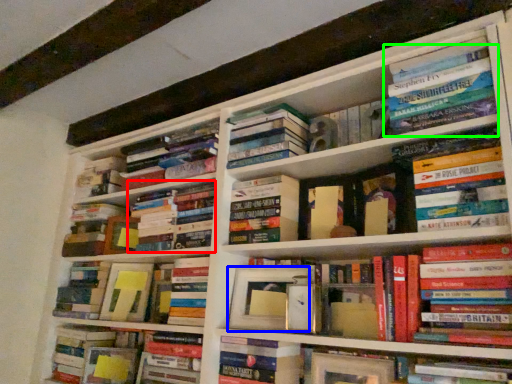
Question: Which is nearer to the book (highlighted by a red box)? paperback book (highlighted by a blue box) or book (highlighted by a green box).

Choices:
 (A) paperback book
 (B) book

Answer: (A)